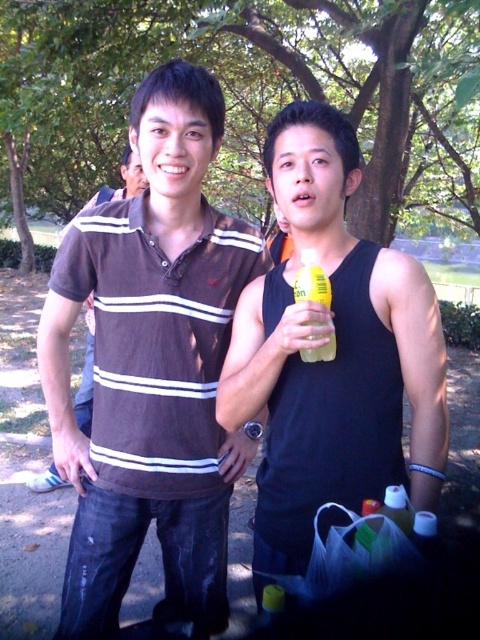
You are a photographer standing 10 feet away from the brown striped polo shirt at center. You want to take a photo of both people in the scene. Will they both fit in the frame if your camera has a 50mm lens and a field of view of 46 degrees?

The two individuals are 4.78 feet apart. With a 50mm lens and a 46 degree field of view, the maximum width that can be captured at 10 feet is approximately 7.8 feet. Since 4.78 feet is less than 7.8 feet, both people will fit within the frame.

You are a photographer trying to capture both the brown striped polo shirt at center and the brown striped shirt at center in the same frame. Which of the two clothing items would appear larger in the photo?

The brown striped polo shirt at center is smaller in size compared to the brown striped shirt at center, so the brown striped shirt at center would appear larger in the photo.

You are a photographer trying to capture a clear photo of both the black matte tank top at center and the brown striped shirt at center. Since you want both to be in focus, which one should you adjust your camera focus on first?

The black matte tank top at center is closer to the viewer than the brown striped shirt at center. To ensure both are in focus, you should focus on the black matte tank top at center first, as it is closer, and the depth of field will extend backward to include the brown striped shirt at center.